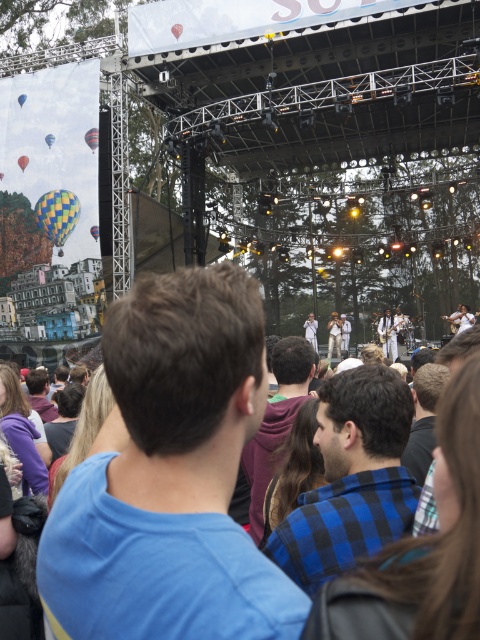
You are a photographer at the concert and want to capture the checkered fabric balloon at upper left in your shot. The camera has a focus point at coordinates 0.336, 0.121. Is the balloon positioned where the focus point is?

Yes, the checkered fabric balloon at upper left is exactly at the focus point (58, 214).

You are a photographer trying to capture both the multicolored fabric hot air balloon at upper left and the checkered fabric hot air balloon at upper left in a single shot. Based on their positions, which balloon should you adjust your camera angle to focus on first to ensure both are in frame?

The multicolored fabric hot air balloon at upper left might be wider than the checkered fabric hot air balloon at upper left, so you should adjust your camera angle to focus on the multicolored one first to accommodate its width.